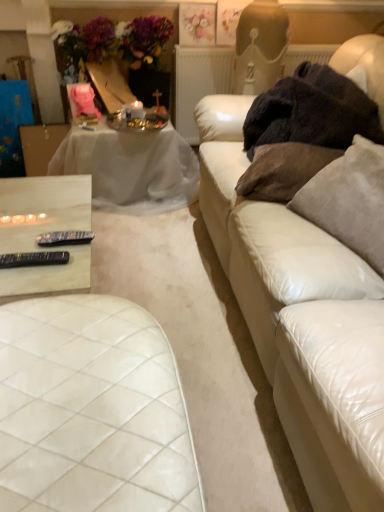
Locate an element on the screen. This screenshot has width=384, height=512. blank space situated above white marble remote controls at lower left, which is counted as the first table, starting from the front (from a real-world perspective) is located at coordinates tap(28, 222).